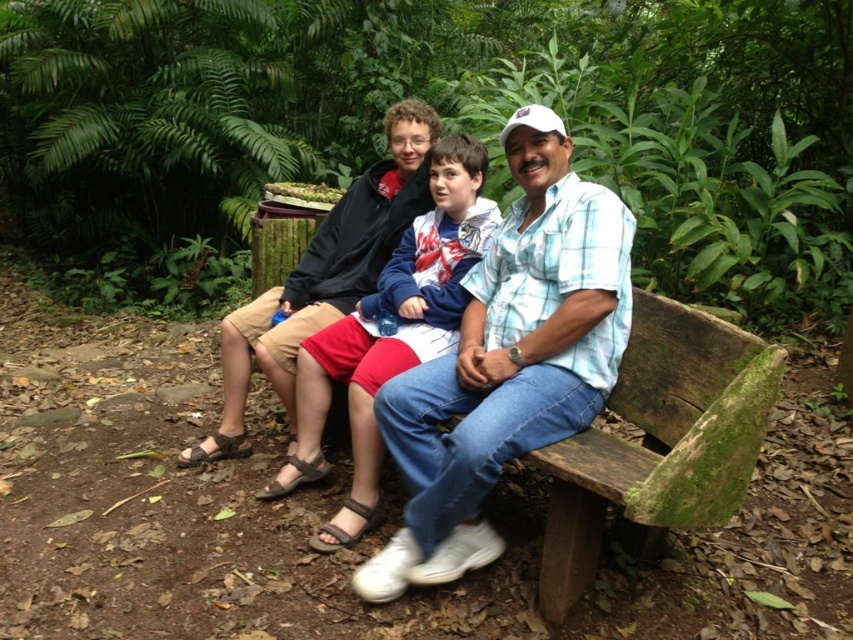
Question: Where is light blue plaid shirt at center located in relation to green mossy wood bench at right in the image?

Choices:
 (A) below
 (B) above

Answer: (B)

Question: Can you confirm if light blue plaid shirt at center is thinner than green mossy wood bench at right?

Choices:
 (A) no
 (B) yes

Answer: (A)

Question: Considering the real-world distances, which object is farthest from the green mossy wood bench at right?

Choices:
 (A) blue plaid shirt at center
 (B) light blue plaid shirt at center

Answer: (A)

Question: Is light blue plaid shirt at center to the left of green mossy wood bench at right from the viewer's perspective?

Choices:
 (A) yes
 (B) no

Answer: (A)

Question: Which point appears closest to the camera in this image?

Choices:
 (A) pos(405,337)
 (B) pos(589,342)
 (C) pos(561,605)

Answer: (C)

Question: Which object is farther from the camera taking this photo?

Choices:
 (A) green mossy wood bench at right
 (B) light blue plaid shirt at center

Answer: (B)